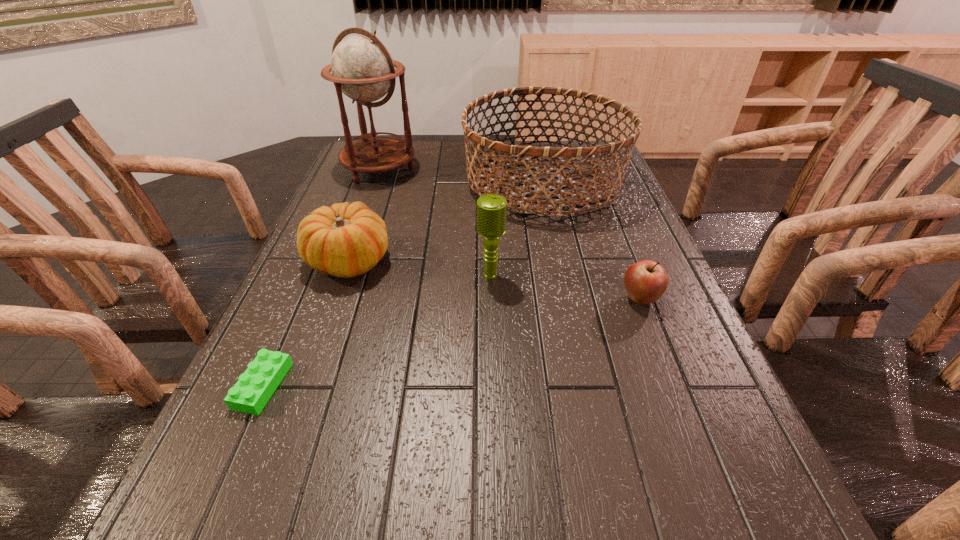
Find the location of `the tallest object`. the tallest object is located at coordinates (362, 68).

You are a GUI agent. You are given a task and a screenshot of the screen. Output one action in this format:
    pyautogui.click(x=<x>, y=<y>)
    Task: Click on the basket
    The height and width of the screenshot is (540, 960).
    Given the screenshot: What is the action you would take?
    pyautogui.click(x=593, y=151)

Locate an element on the screen. microphone is located at coordinates (491, 209).

Where is `gourd`? gourd is located at coordinates (345, 240).

You are a GUI agent. You are given a task and a screenshot of the screen. Output one action in this format:
    pyautogui.click(x=<x>, y=<y>)
    Task: Click on the apple
    The height and width of the screenshot is (540, 960).
    Given the screenshot: What is the action you would take?
    pyautogui.click(x=646, y=281)

Identify the location of the shortest object. (250, 394).

Locate an element on the screen. Image resolution: width=960 pixels, height=540 pixels. Lego is located at coordinates (250, 394).

The width and height of the screenshot is (960, 540). In order to click on free point located on the surface of the globe in this screenshot , I will do `click(368, 199)`.

At what (x,y) coordinates should I click in order to perform the action: click on free space located 0.160m on the front of the basket. Please return your answer as a coordinate pair (x, y). Looking at the image, I should click on (561, 263).

This screenshot has width=960, height=540. I want to click on vacant space located 0.150m on the right of the microphone, so click(x=569, y=276).